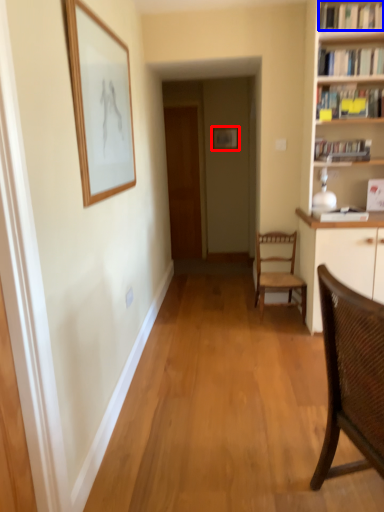
Question: Which of the following is the farthest to the observer, picture frame (highlighted by a red box) or book (highlighted by a blue box)?

Choices:
 (A) picture frame
 (B) book

Answer: (A)